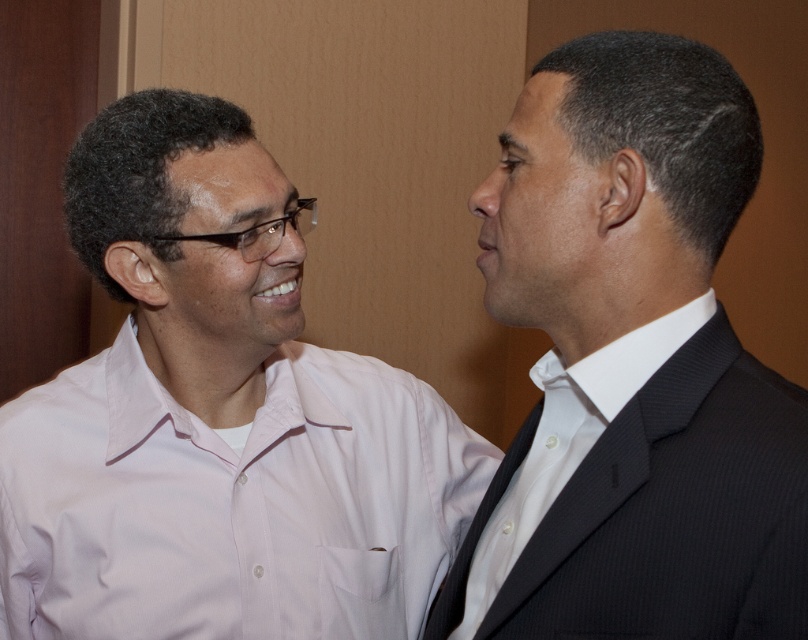
Question: Can you confirm if pink cotton shirt at left is smaller than black suit at right?

Choices:
 (A) yes
 (B) no

Answer: (B)

Question: Among these points, which one is farthest from the camera?

Choices:
 (A) (85, 401)
 (B) (596, 352)

Answer: (A)

Question: Is pink cotton shirt at left smaller than white smooth shirt at right?

Choices:
 (A) yes
 (B) no

Answer: (B)

Question: Is pink cotton shirt at left smaller than white smooth shirt at right?

Choices:
 (A) yes
 (B) no

Answer: (B)

Question: Estimate the real-world distances between objects in this image. Which object is closer to the white smooth shirt at right?

Choices:
 (A) black suit at right
 (B) pink cotton shirt at left

Answer: (A)

Question: Among these objects, which one is farthest from the camera?

Choices:
 (A) white smooth shirt at right
 (B) pink cotton shirt at left
 (C) black suit at right

Answer: (B)